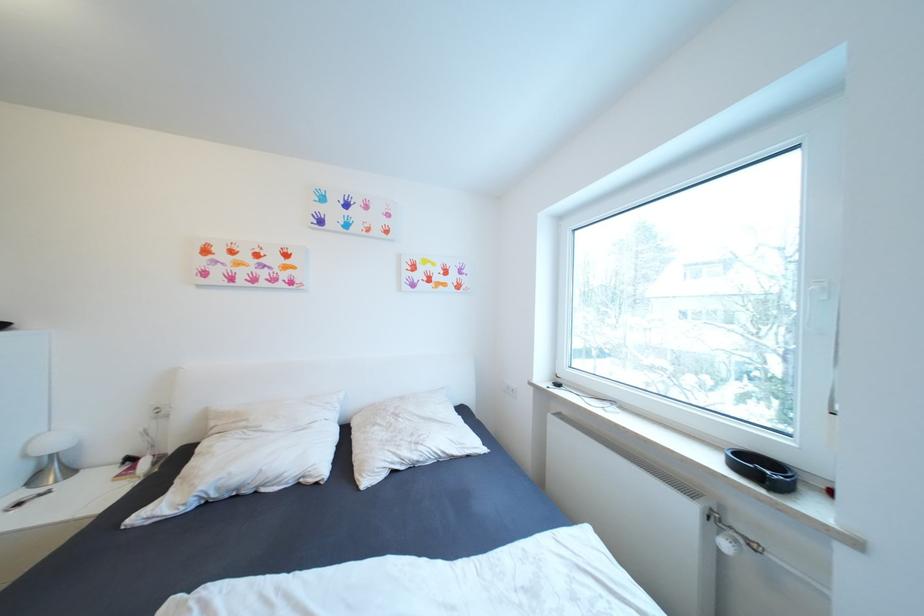
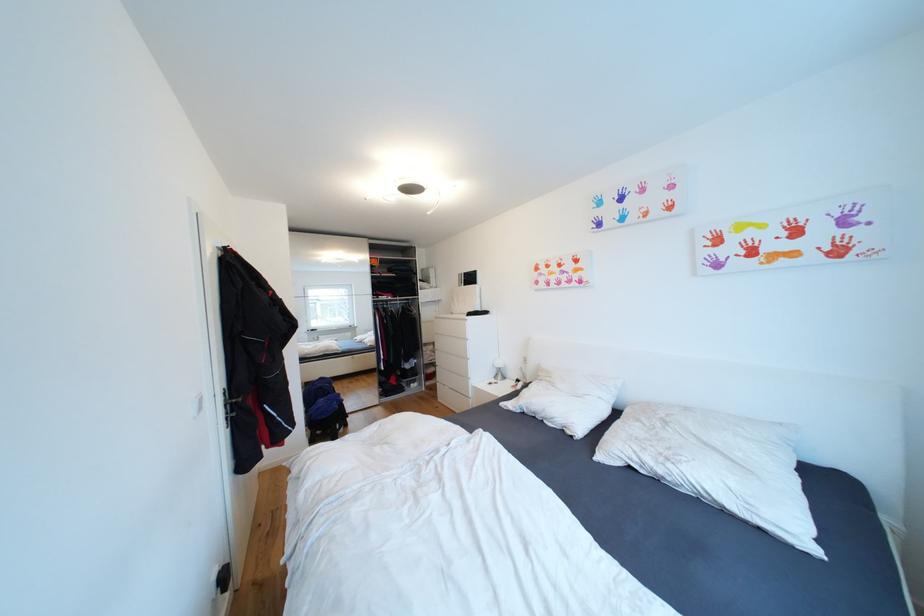
Find the pixel in the second image that matches pixel 42 480 in the first image.

(503, 378)